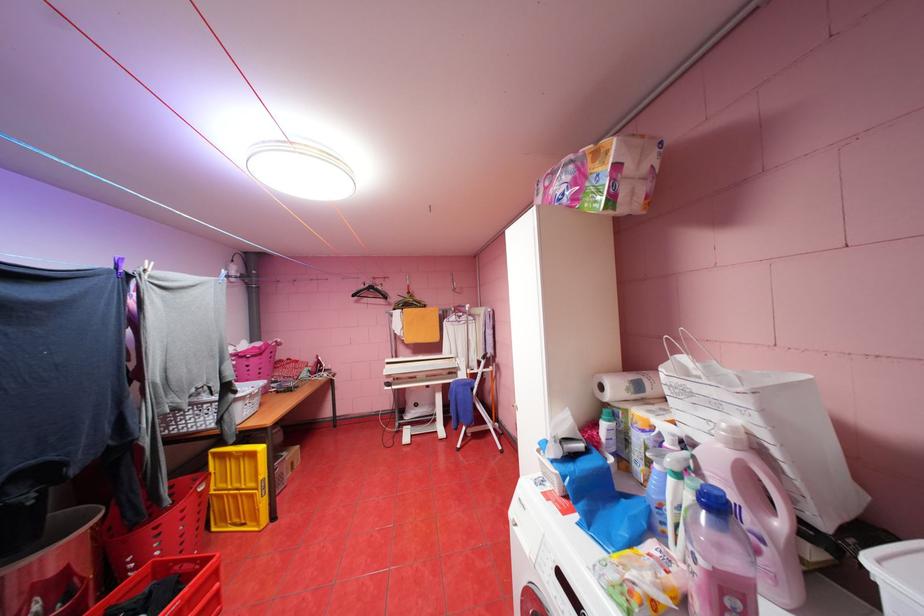
At what (x,y) coordinates should I click in order to perform the action: click on wooden clothespin. Please return your answer as a coordinate pair (x, y). The height and width of the screenshot is (616, 924). Looking at the image, I should click on (237, 488).